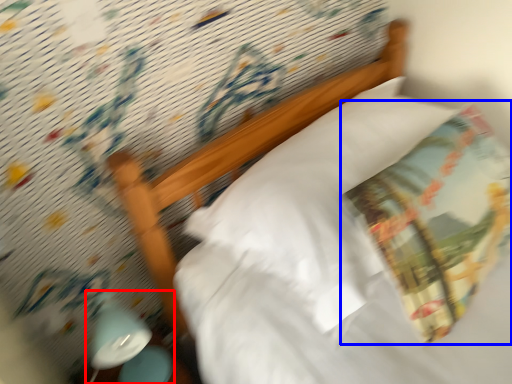
Question: Which object is closer to the camera taking this photo, bedside lamp (highlighted by a red box) or throw pillow (highlighted by a blue box)?

Choices:
 (A) bedside lamp
 (B) throw pillow

Answer: (B)